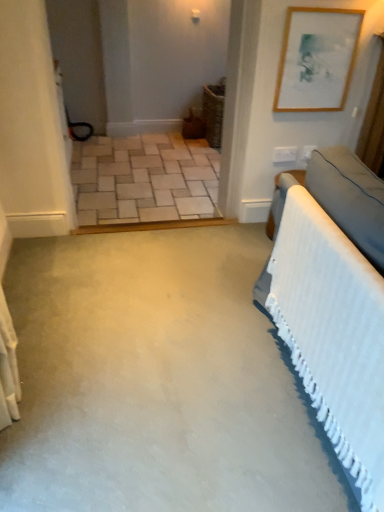
Question: Is velvet grey bed at right completely or partially outside of beige brick floor at center?

Choices:
 (A) no
 (B) yes

Answer: (B)

Question: Is velvet grey bed at right aimed at beige brick floor at center?

Choices:
 (A) yes
 (B) no

Answer: (B)

Question: Is velvet grey bed at right wider than beige brick floor at center?

Choices:
 (A) no
 (B) yes

Answer: (A)

Question: From a real-world perspective, is velvet grey bed at right under beige brick floor at center?

Choices:
 (A) yes
 (B) no

Answer: (B)

Question: Is beige brick floor at center a part of velvet grey bed at right?

Choices:
 (A) no
 (B) yes

Answer: (A)

Question: Considering their positions, is velvet grey bed at right located in front of or behind wooden picture frame at upper right?

Choices:
 (A) behind
 (B) front

Answer: (B)

Question: In terms of height, does velvet grey bed at right look taller or shorter compared to wooden picture frame at upper right?

Choices:
 (A) short
 (B) tall

Answer: (B)

Question: Is velvet grey bed at right to the left or to the right of wooden picture frame at upper right in the image?

Choices:
 (A) right
 (B) left

Answer: (B)

Question: Is velvet grey bed at right inside or outside of wooden picture frame at upper right?

Choices:
 (A) inside
 (B) outside

Answer: (B)

Question: Which is correct: wooden picture frame at upper right is inside beige brick floor at center, or outside of it?

Choices:
 (A) outside
 (B) inside

Answer: (A)

Question: Looking at the image, does wooden picture frame at upper right seem bigger or smaller compared to beige brick floor at center?

Choices:
 (A) small
 (B) big

Answer: (A)

Question: In the image, is wooden picture frame at upper right on the left side or the right side of beige brick floor at center?

Choices:
 (A) left
 (B) right

Answer: (B)

Question: From their relative heights in the image, would you say wooden picture frame at upper right is taller or shorter than beige brick floor at center?

Choices:
 (A) tall
 (B) short

Answer: (A)

Question: Considering the relative positions of beige brick floor at center and velvet grey bed at right in the image provided, is beige brick floor at center to the left or to the right of velvet grey bed at right?

Choices:
 (A) right
 (B) left

Answer: (B)

Question: Considering the positions of beige brick floor at center and velvet grey bed at right in the image, is beige brick floor at center taller or shorter than velvet grey bed at right?

Choices:
 (A) tall
 (B) short

Answer: (B)